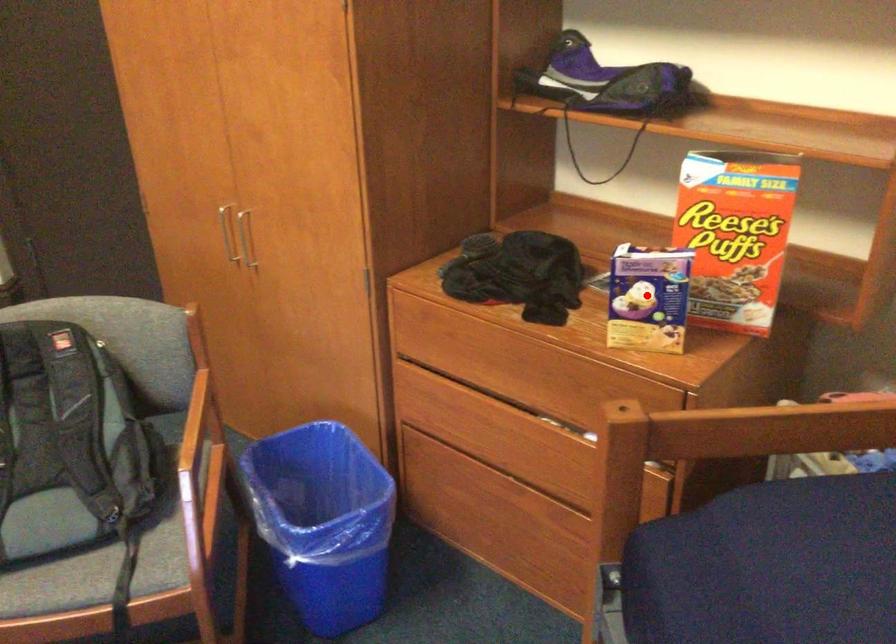
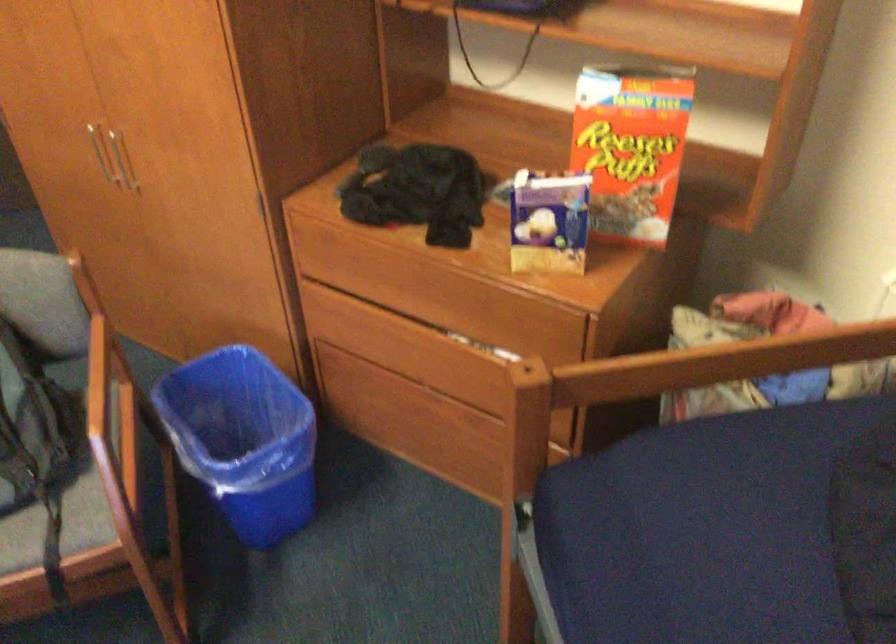
Question: I am providing you with two images of the same scene from different viewpoints. A red point is marked on the first image. Is the red point's position out of view in image 2?

Choices:
 (A) Yes
 (B) No

Answer: (B)